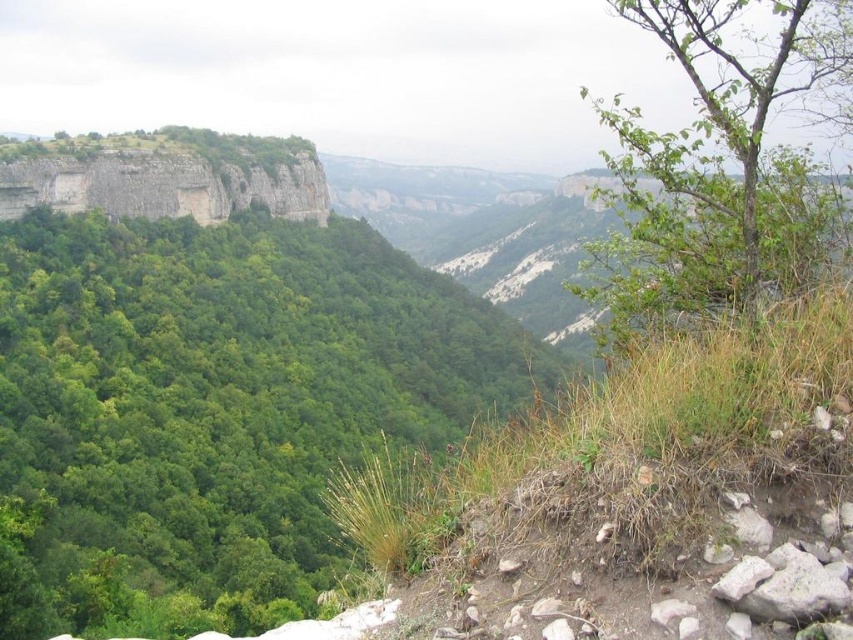
Consider the image. How far apart are green leafy tree at center and green leafy tree at upper right?

green leafy tree at center is 68.56 meters from green leafy tree at upper right.

Does green leafy tree at center appear under green leafy tree at upper right?

Yes, green leafy tree at center is below green leafy tree at upper right.

Identify the location of green leafy tree at center. (215, 403).

The height and width of the screenshot is (640, 853). I want to click on green leafy tree at center, so click(x=215, y=403).